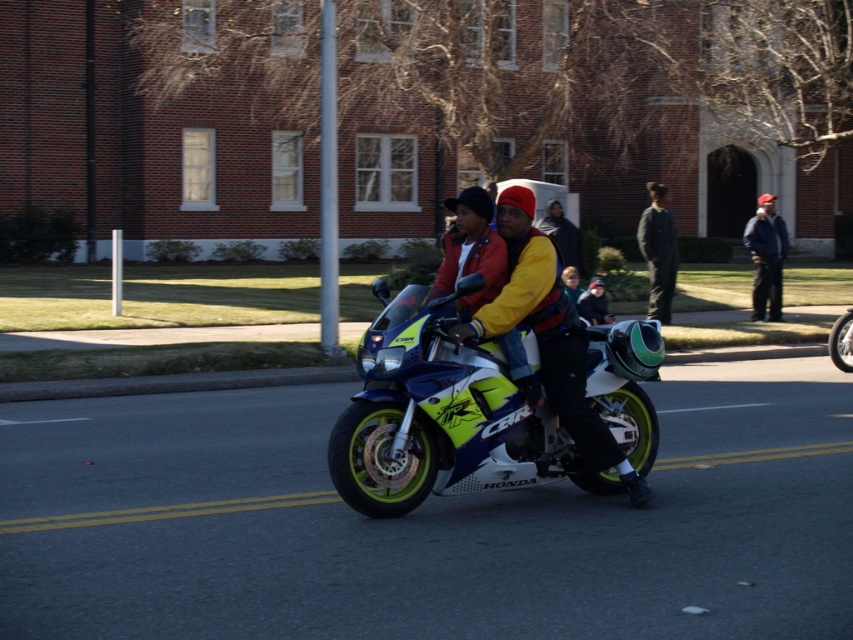
Question: Does neon yellow/green plastic motorbike at center have a larger size compared to dark gray jumpsuit at center?

Choices:
 (A) no
 (B) yes

Answer: (B)

Question: Where is yellow matte jacket at center located in relation to dark gray jumpsuit at center in the image?

Choices:
 (A) below
 (B) above

Answer: (A)

Question: Which point is farther to the camera?

Choices:
 (A) (665, 301)
 (B) (563, 301)
 (C) (444, 308)

Answer: (A)

Question: Can you confirm if neon yellow/green plastic motorbike at center is smaller than dark gray jumpsuit at center?

Choices:
 (A) yes
 (B) no

Answer: (B)

Question: Considering the real-world distances, which object is farthest from the dark gray jumpsuit at center?

Choices:
 (A) yellow matte jacket at center
 (B) neon yellow/green plastic motorbike at center

Answer: (B)

Question: Which point is closer to the camera taking this photo?

Choices:
 (A) (372, 328)
 (B) (546, 288)
 (C) (663, 252)

Answer: (A)